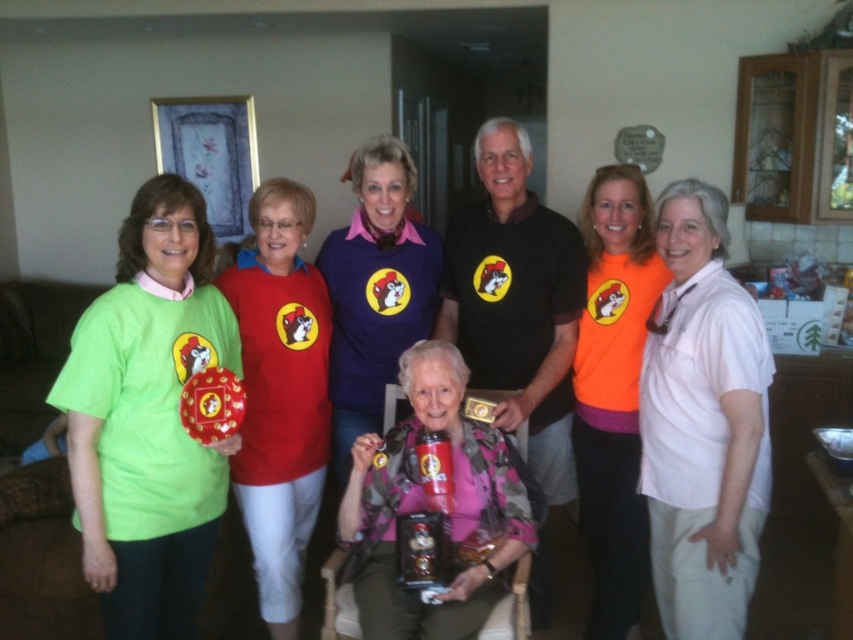
You are a photographer trying to capture the group photo. You notice a point at coordinate [148,419] on the image. Based on the scene description, which object does this point lie on?

The point at coordinate [148,419] lies on the matte green tshirt at left.

You are a photographer trying to adjust the lighting for a group photo. You notice two shirts in the center of the image, a matte red shirt at center and a purple cotton shirt at center. Which shirt is closer to the camera?

The matte red shirt at center is 7.80 inches away from the purple cotton shirt at center, so the purple cotton shirt at center is closer to the camera since it is positioned behind the matte red shirt at center.